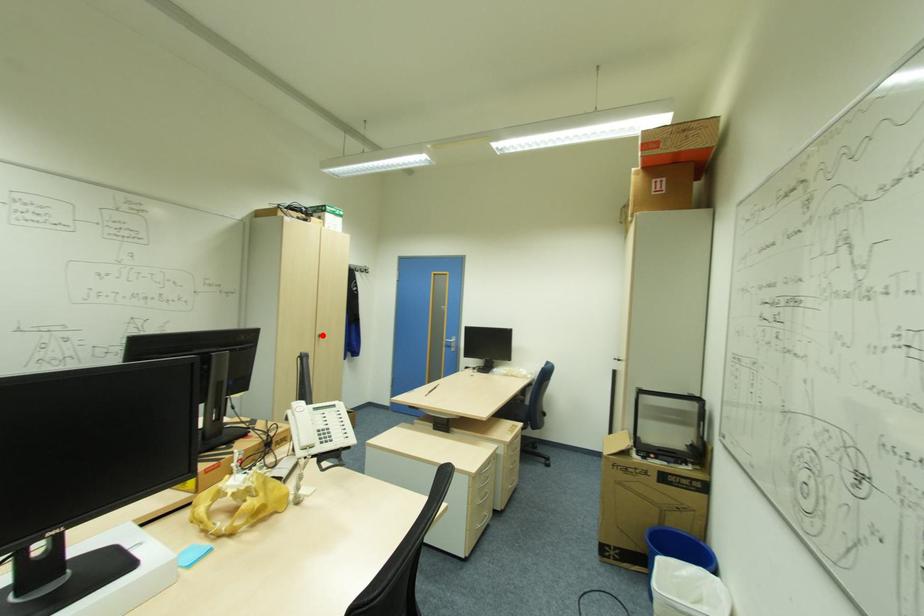
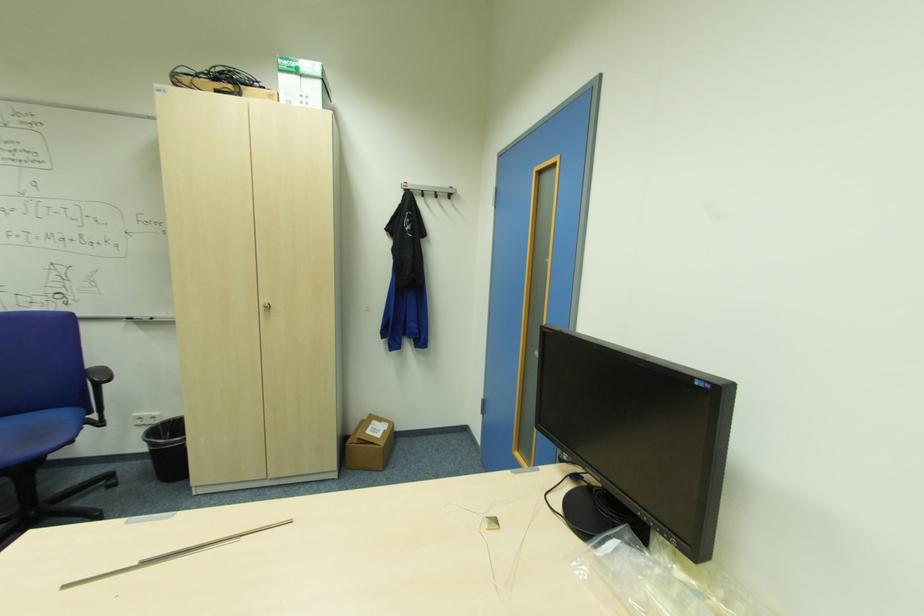
In the second image, find the point that corresponds to the highlighted location in the first image.

(271, 307)